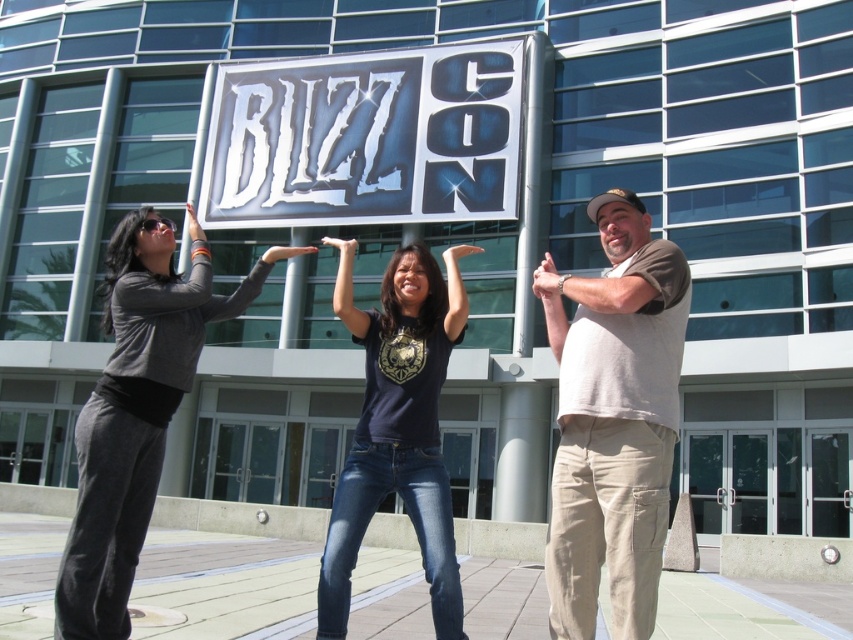
You are a photographer standing at the entrance of the building. You want to take a photo that includes both the metallic silver sign at center and the matte black shirt at center. Given that your camera has a maximum focus range of 80 feet, will you be able to capture both objects in focus simultaneously?

The metallic silver sign at center and matte black shirt at center are 86.80 feet apart from each other, which exceeds the camera maximum focus range of 80 feet. Therefore, you cannot capture both objects in focus simultaneously.

You are a photographer standing at the center of the image. You want to capture a photo that includes both the beige cotton pants at right and the BLIZZCON sign. Based on their positions, which object is closer to the center of the image?

The beige cotton pants at right is located at point (613, 420), which is closer to the center of the image compared to the BLIZZCON sign, so the beige cotton pants at right is closer to the center.

You are a photographer trying to capture a candid shot of the matte black shirt at center without the metallic silver sign at center blocking the view. Is this possible given their positions?

The matte black shirt at center is behind the metallic silver sign at center, so it would be blocked from view. You cannot capture a clear shot of the matte black shirt at center without the sign obstructing it.